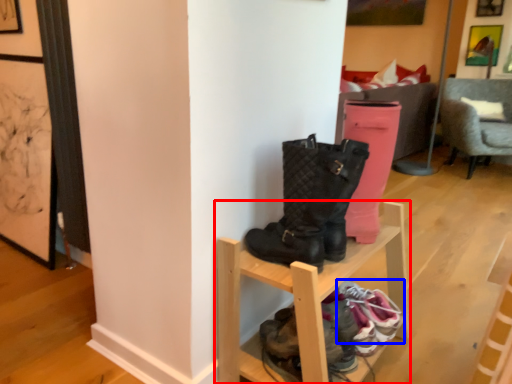
Question: Which point is further to the camera, shelf (highlighted by a red box) or footwear (highlighted by a blue box)?

Choices:
 (A) shelf
 (B) footwear

Answer: (B)